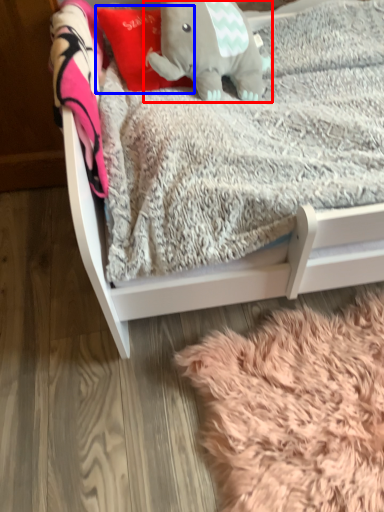
Question: Which object is closer to the camera taking this photo, elephant (highlighted by a red box) or throw pillow (highlighted by a blue box)?

Choices:
 (A) elephant
 (B) throw pillow

Answer: (A)